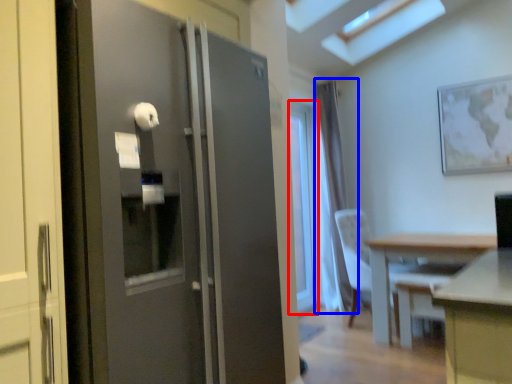
Question: Which object appears farthest to the camera in this image, window (highlighted by a red box) or curtain (highlighted by a blue box)?

Choices:
 (A) window
 (B) curtain

Answer: (B)